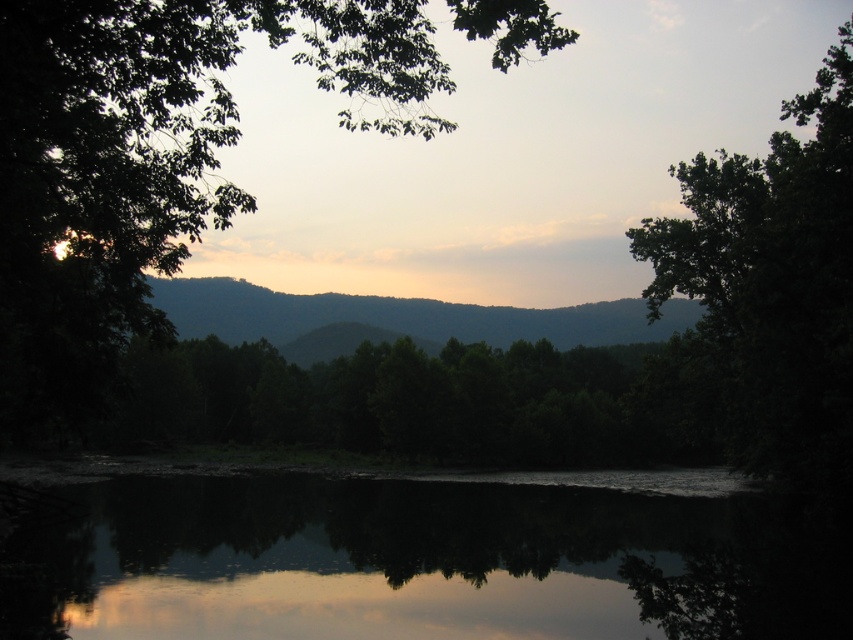
You are an artist trying to paint this landscape. You want to ensure the reflective dark water at center and the green leafy tree at upper right are proportionally accurate. Which object should you paint first to maintain proper scaling, and why?

You should paint the green leafy tree at upper right first because the reflective dark water at center is smaller than it. By starting with the larger object, you can ensure the smaller one is scaled appropriately in relation.

You are an artist planning to sketch this landscape. You want to ensure the green leafy tree at center and the green matte mountain at center are proportionally accurate. Which object should you draw with a narrower width in your sketch?

The green leafy tree at center should be drawn with a narrower width than the green matte mountain at center because the description states that the green leafy tree at center is thinner than the green matte mountain at center.

You are an observer looking at the image. You notice the green leafy tree at center and the green matte mountain at center. Which object is positioned higher in the scene?

The green leafy tree at center is positioned higher than the green matte mountain at center according to the description.